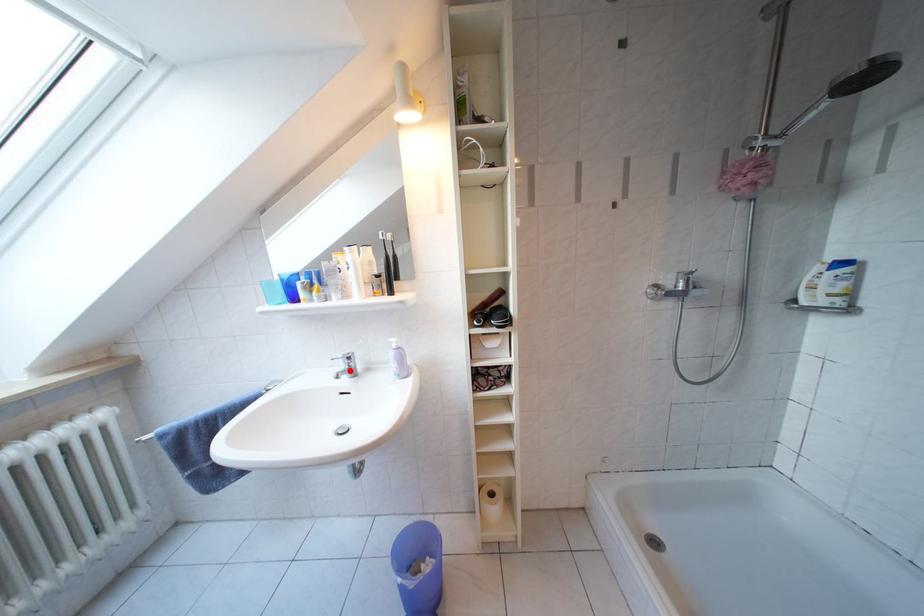
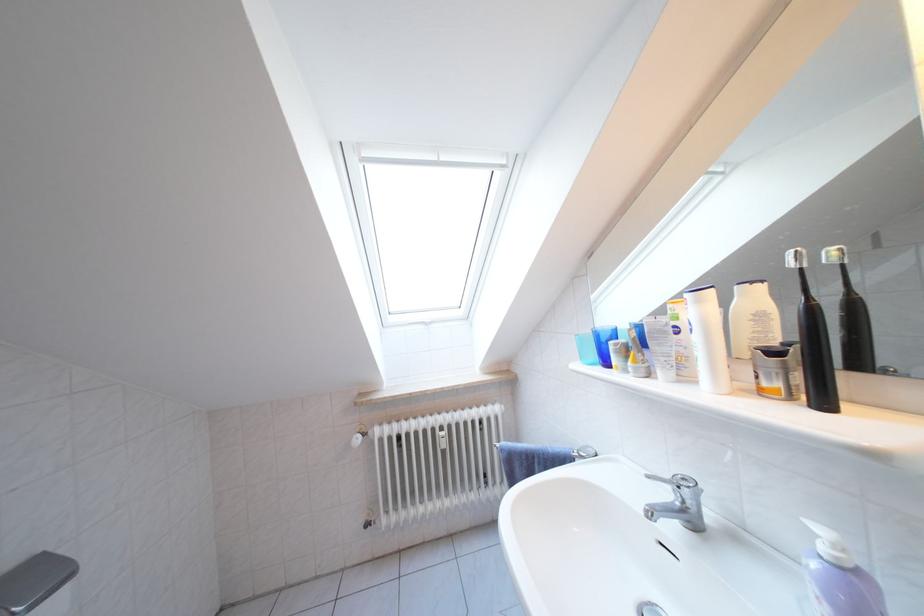
Question: I am providing you with two images of the same scene from different viewpoints. A red point is marked on the first image. Is the red point's position out of view in image 2?

Choices:
 (A) Yes
 (B) No

Answer: (B)